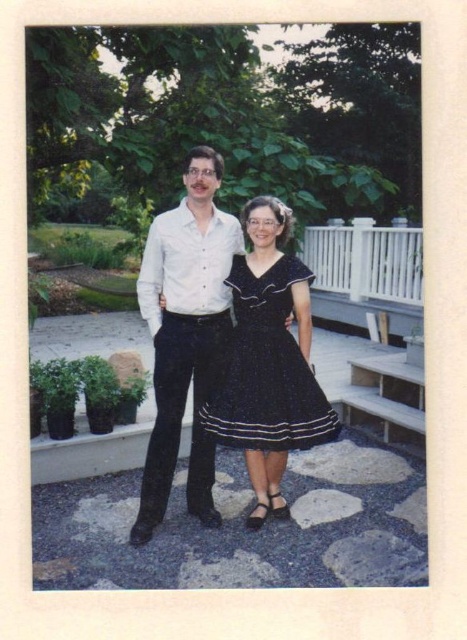
Can you confirm if white glossy shirt at center is thinner than dark blue satin dress at center?

Yes, white glossy shirt at center is thinner than dark blue satin dress at center.

Who is more distant from viewer, (218, 154) or (242, 260)?

The point (242, 260) is behind.

What do you see at coordinates (185, 333) in the screenshot? The height and width of the screenshot is (640, 467). I see `white glossy shirt at center` at bounding box center [185, 333].

Where is `white glossy shirt at center`? This screenshot has height=640, width=467. white glossy shirt at center is located at coordinates (185, 333).